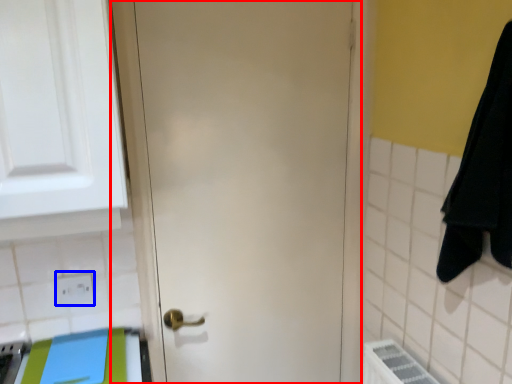
Question: Which of the following is the closest to the observer, door (highlighted by a red box) or electric outlet (highlighted by a blue box)?

Choices:
 (A) door
 (B) electric outlet

Answer: (A)